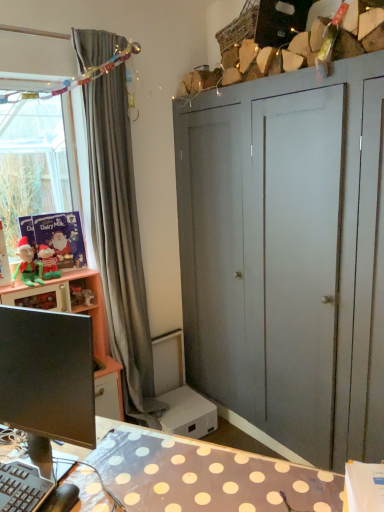
Question: Does matte gray wardrobe at upper right turn towards gray fabric curtain at left?

Choices:
 (A) no
 (B) yes

Answer: (B)

Question: Is there a large distance between matte gray wardrobe at upper right and gray fabric curtain at left?

Choices:
 (A) yes
 (B) no

Answer: (B)

Question: Is matte gray wardrobe at upper right to the right of gray fabric curtain at left from the viewer's perspective?

Choices:
 (A) no
 (B) yes

Answer: (B)

Question: From a real-world perspective, is matte gray wardrobe at upper right located beneath gray fabric curtain at left?

Choices:
 (A) yes
 (B) no

Answer: (A)

Question: Can you confirm if matte gray wardrobe at upper right is bigger than gray fabric curtain at left?

Choices:
 (A) no
 (B) yes

Answer: (B)

Question: Is matte gray wardrobe at upper right positioned in front of gray fabric curtain at left?

Choices:
 (A) no
 (B) yes

Answer: (B)

Question: Can you confirm if green plush elf at left is taller than black glossy monitor at lower left?

Choices:
 (A) yes
 (B) no

Answer: (B)

Question: Can you confirm if green plush elf at left is positioned to the right of black glossy monitor at lower left?

Choices:
 (A) yes
 (B) no

Answer: (B)

Question: From the image's perspective, is green plush elf at left under black glossy monitor at lower left?

Choices:
 (A) yes
 (B) no

Answer: (B)

Question: Is green plush elf at left aimed at black glossy monitor at lower left?

Choices:
 (A) yes
 (B) no

Answer: (B)

Question: From the image's perspective, does green plush elf at left appear higher than black glossy monitor at lower left?

Choices:
 (A) yes
 (B) no

Answer: (A)

Question: Can you confirm if green plush elf at left is shorter than black glossy monitor at lower left?

Choices:
 (A) no
 (B) yes

Answer: (B)

Question: From the image's perspective, is black glossy monitor at lower left above gray fabric curtain at left?

Choices:
 (A) no
 (B) yes

Answer: (A)